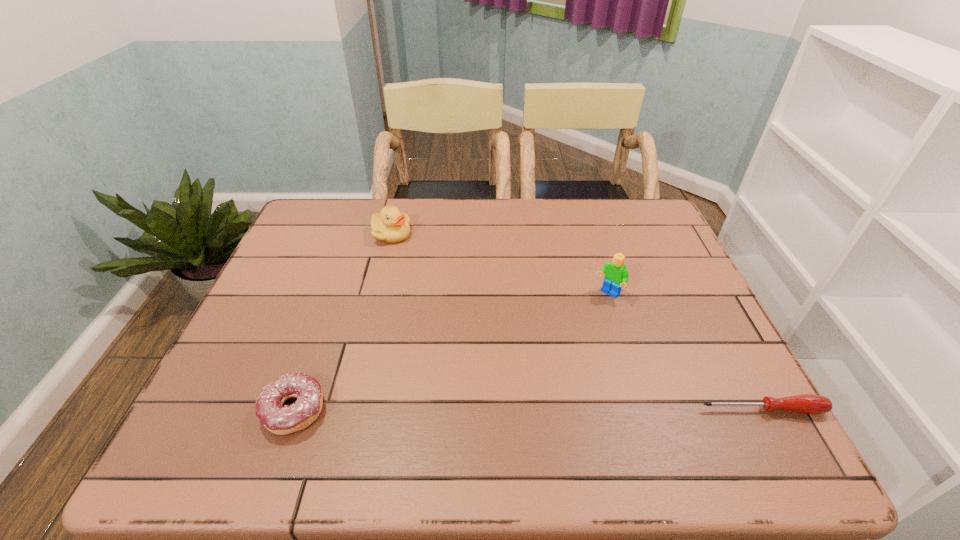
Image resolution: width=960 pixels, height=540 pixels. I want to click on the third tallest object, so click(281, 420).

Locate an element on the screen. screwdriver is located at coordinates (807, 403).

I want to click on the shortest object, so click(x=807, y=403).

You are a GUI agent. You are given a task and a screenshot of the screen. Output one action in this format:
    pyautogui.click(x=<x>, y=<y>)
    Task: Click on the second farthest object
    
    Given the screenshot: What is the action you would take?
    pyautogui.click(x=616, y=274)

In order to click on the tallest object in this screenshot , I will do `click(616, 274)`.

You are a GUI agent. You are given a task and a screenshot of the screen. Output one action in this format:
    pyautogui.click(x=<x>, y=<y>)
    Task: Click on the farthest object
    
    Given the screenshot: What is the action you would take?
    pyautogui.click(x=391, y=226)

Identify the location of duckling. This screenshot has height=540, width=960. (391, 226).

Locate an element on the screen. free spot located on the back of the doughnut is located at coordinates (339, 281).

Where is `vacant space located 0.160m on the face of the second farthest object`? The width and height of the screenshot is (960, 540). vacant space located 0.160m on the face of the second farthest object is located at coordinates (569, 338).

This screenshot has height=540, width=960. Find the location of `vacant space located 0.400m on the face of the second farthest object`. vacant space located 0.400m on the face of the second farthest object is located at coordinates (509, 408).